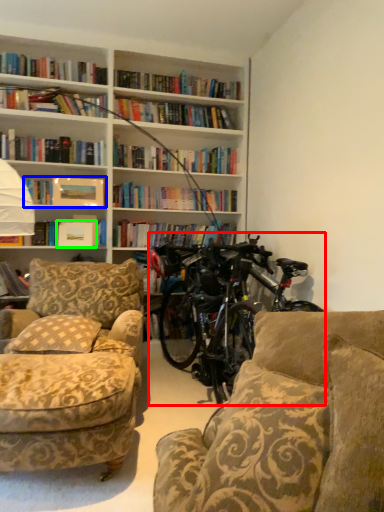
Question: Which object is the farthest from bicycle (highlighted by a red box)? Choose among these: book (highlighted by a blue box) or paperback book (highlighted by a green box).

Choices:
 (A) book
 (B) paperback book

Answer: (A)